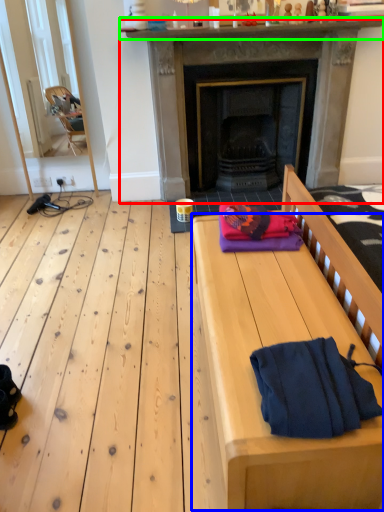
Question: Based on their relative distances, which object is farther from fireplace (highlighted by a red box)? Choose from table (highlighted by a blue box) and mantle (highlighted by a green box).

Choices:
 (A) table
 (B) mantle

Answer: (A)